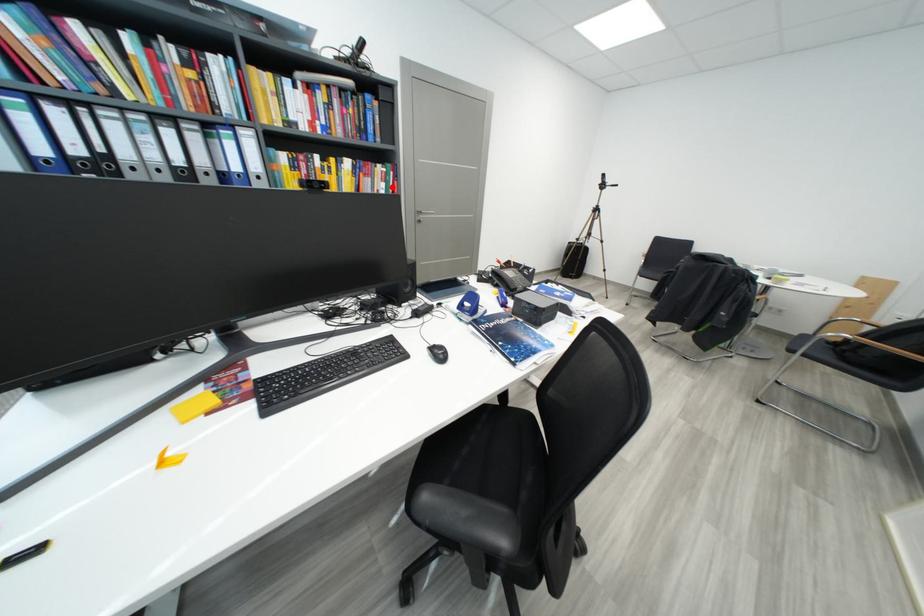
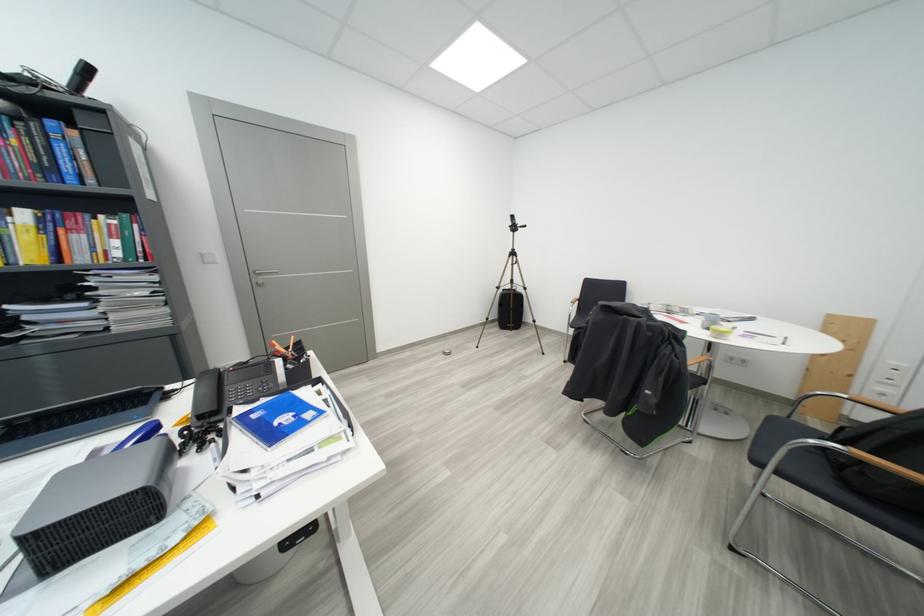
Locate, in the second image, the point that corresponds to the highlighted location in the first image.

(126, 245)